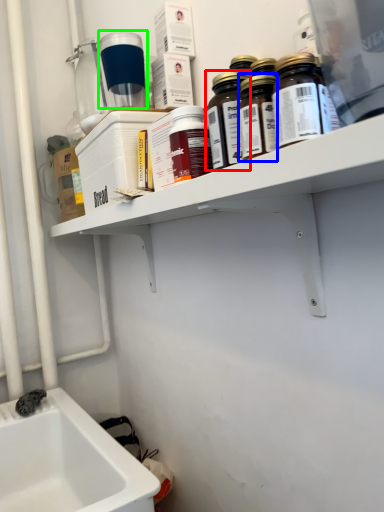
Question: Which object is the farthest from bottle (highlighted by a red box)? Choose among these: bottle (highlighted by a blue box) or bottle (highlighted by a green box).

Choices:
 (A) bottle
 (B) bottle

Answer: (B)